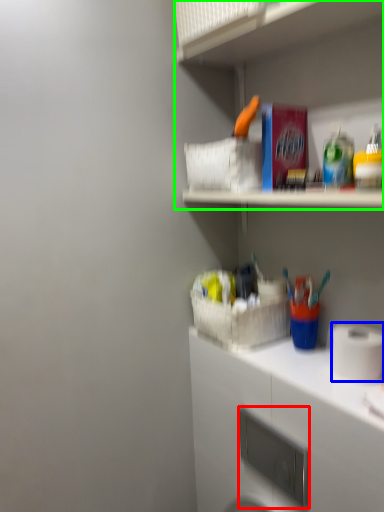
Question: Which is nearer to the appliance (highlighted by a red box)? toilet paper (highlighted by a blue box) or shelf (highlighted by a green box).

Choices:
 (A) toilet paper
 (B) shelf

Answer: (A)